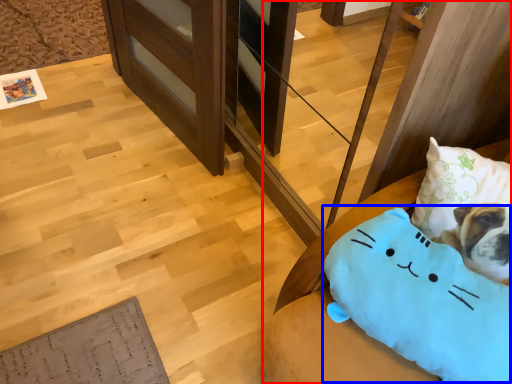
Question: Among these objects, which one is nearest to the camera, furniture (highlighted by a red box) or pillow (highlighted by a blue box)?

Choices:
 (A) furniture
 (B) pillow

Answer: (B)